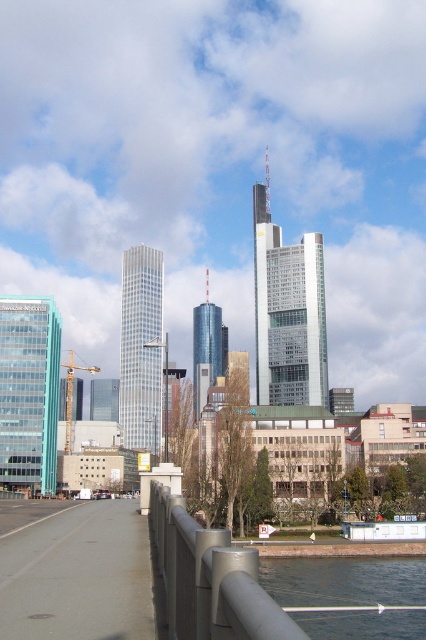
You are a city planner reviewing this area and need to ensure safety. The metallic gray railing at lower center and the blue water at lower right are both in the vicinity. Given their sizes, which object might pose a safety concern for children playing near them?

The metallic gray railing at lower center has a smaller size compared to blue water at lower right, so it might pose a safety concern because smaller railings could have gaps that are hazardous for children.

You are a city planner assessing the space between the metallic gray railing at lower center and the blue water at lower right. Which object is narrower in width?

The metallic gray railing at lower center is narrower in width compared to the blue water at lower right according to the description.

You are a drone operator who needs to fly a drone 25 feet away from the camera to capture aerial footage. The metallic gray railing at lower center is in your path. Can your drone safely pass by the railing without getting too close?

The metallic gray railing at lower center is 22.83 feet from the camera, which is within the 25 feet distance you need to maintain. Therefore, the drone can safely pass by the railing as it is already within the required distance range.